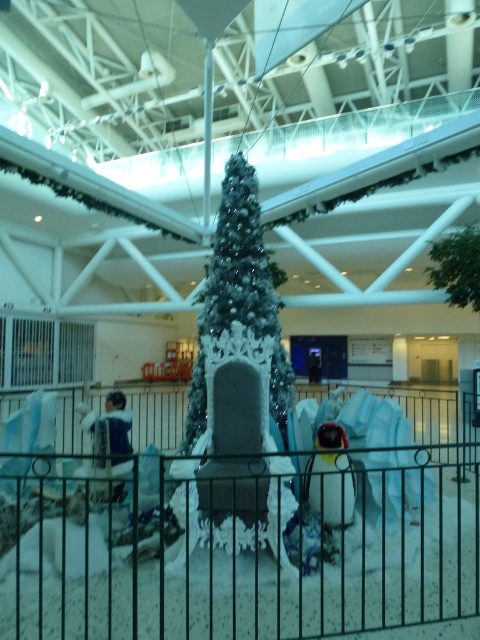
You are a delivery person trying to move a large box through the space between the black metal fence at center and the white frosted christmas tree at center. The box is 1.2 meters wide. Can you fit the box through the space between them?

The black metal fence at center might be wider than the white frosted christmas tree at center, so the space between them could be wide enough to fit the 1.2 meter wide box. However, since the exact width isn

You are a delivery person carrying a package that is 8 feet long. You need to navigate through the space between the black metal fence at center and the closest holiday decoration. Will your package fit through the space?

The space between the black metal fence at center and the closest holiday decoration is 8.51 feet. Since your package is 8 feet long, it will fit through the space as there is enough clearance.